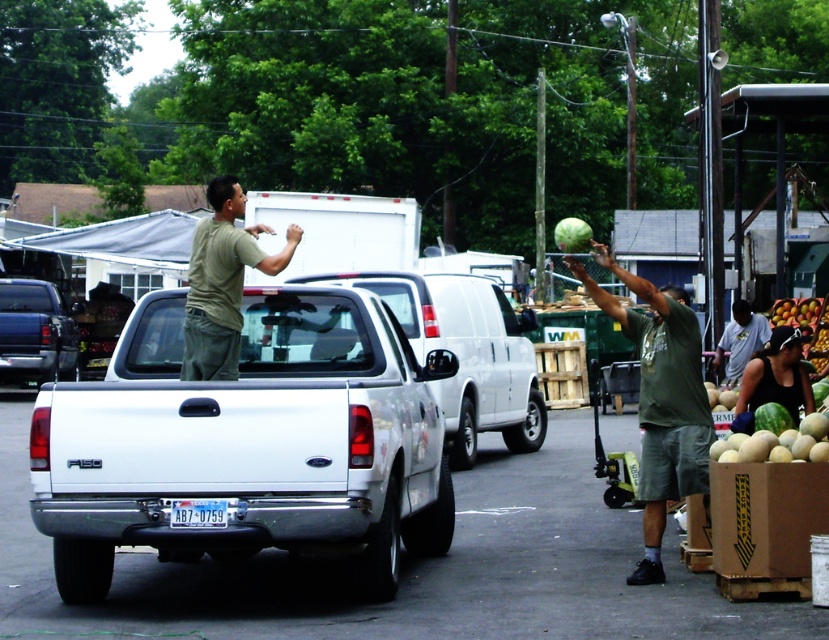
Is white matte truck at center further to camera compared to white plastic license plate at center?

No, it is in front of white plastic license plate at center.

Can you confirm if white matte truck at center is positioned to the left of white plastic license plate at center?

No, white matte truck at center is not to the left of white plastic license plate at center.

You are a GUI agent. You are given a task and a screenshot of the screen. Output one action in this format:
    pyautogui.click(x=<x>, y=<y>)
    Task: Click on the white matte truck at center
    The height and width of the screenshot is (640, 829).
    Given the screenshot: What is the action you would take?
    pyautogui.click(x=251, y=449)

Is green matte watermelon at center thinner than gray cotton shirt at right?

Indeed, green matte watermelon at center has a lesser width compared to gray cotton shirt at right.

Which is in front, point (642, 291) or point (755, 326)?

Point (642, 291) is more forward.

Image resolution: width=829 pixels, height=640 pixels. I want to click on green matte watermelon at center, so click(x=660, y=397).

Is metallic blue truck at left taller than white plastic license plate at center?

Yes.

Is metallic blue truck at left to the left of white plastic license plate at center from the viewer's perspective?

Correct, you'll find metallic blue truck at left to the left of white plastic license plate at center.

Locate an element on the screen. The width and height of the screenshot is (829, 640). metallic blue truck at left is located at coordinates coord(35,333).